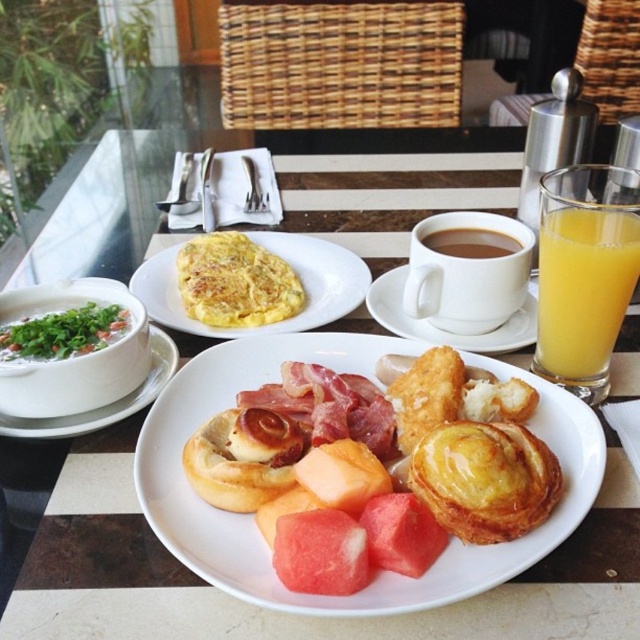
You are pouring hot coffee into the cups. Which cup will get filled first, the white ceramic cup at center or the brown matte cup at center?

The white ceramic cup at center will be filled first because it is positioned under the brown matte cup at center, so the coffee will flow into it first.